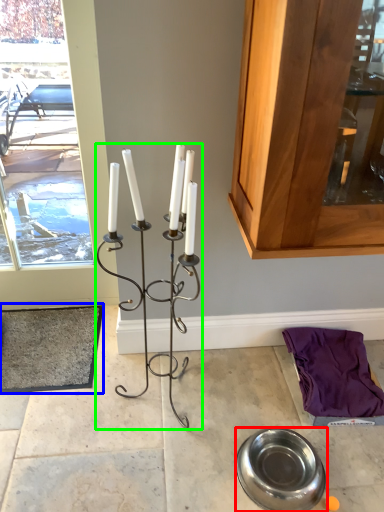
Question: Which is farther away from tableware (highlighted by a red box)? doormat (highlighted by a blue box) or candle holder (highlighted by a green box)?

Choices:
 (A) doormat
 (B) candle holder

Answer: (A)